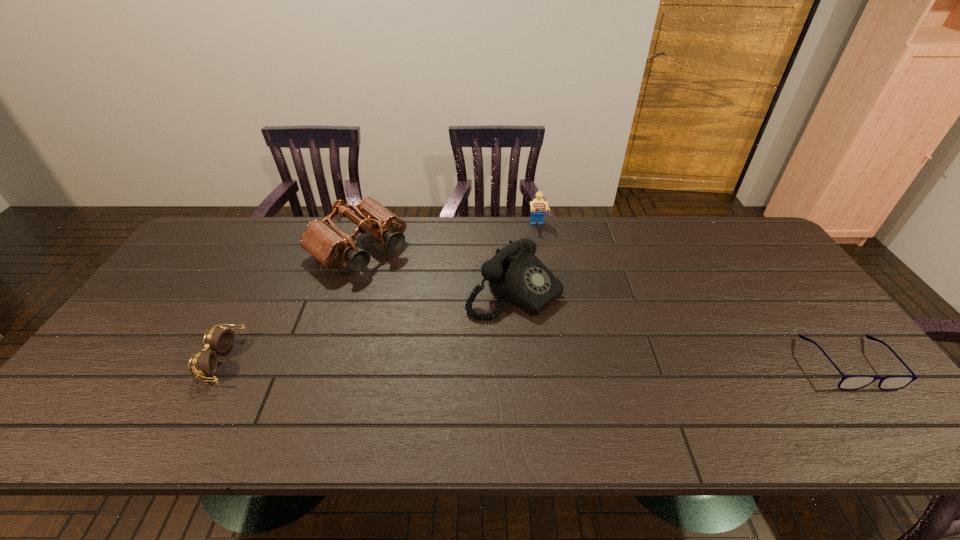
Image resolution: width=960 pixels, height=540 pixels. What are the coordinates of `Lego that is positioned at the far edge` in the screenshot? It's located at (537, 205).

I want to click on goggles that is at the near edge, so click(203, 363).

The width and height of the screenshot is (960, 540). What are the coordinates of `spectacles located at the near edge` in the screenshot? It's located at (849, 382).

At what (x,y) coordinates should I click in order to perform the action: click on object at the right edge. Please return your answer as a coordinate pair (x, y). Looking at the image, I should click on (849, 382).

Find the location of a particular element. object at the near right corner is located at coordinates (849, 382).

The height and width of the screenshot is (540, 960). Identify the location of vacant space at the far edge. (281, 222).

Find the location of a particular element. blank area at the near edge is located at coordinates (368, 403).

Where is `free space at the right edge`? Image resolution: width=960 pixels, height=540 pixels. free space at the right edge is located at coordinates (741, 265).

Where is `vacant space at the near right corner of the desktop`? vacant space at the near right corner of the desktop is located at coordinates (x=851, y=373).

The width and height of the screenshot is (960, 540). I want to click on free space between the binoculars and the goggles, so click(x=290, y=304).